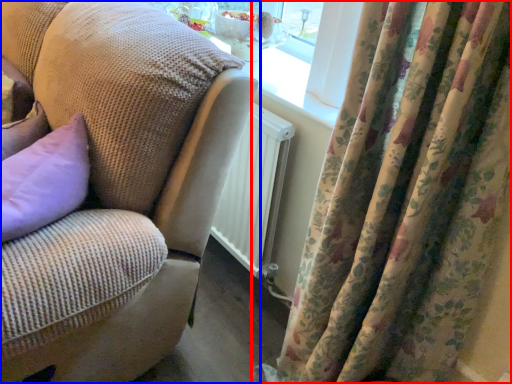
Question: Which point is further to the camera, curtain (highlighted by a red box) or studio couch (highlighted by a blue box)?

Choices:
 (A) curtain
 (B) studio couch

Answer: (B)